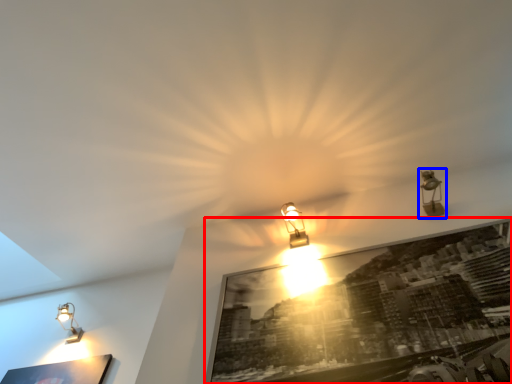
Question: Among these objects, which one is nearest to the camera, picture frame (highlighted by a red box) or lamp (highlighted by a blue box)?

Choices:
 (A) picture frame
 (B) lamp

Answer: (A)